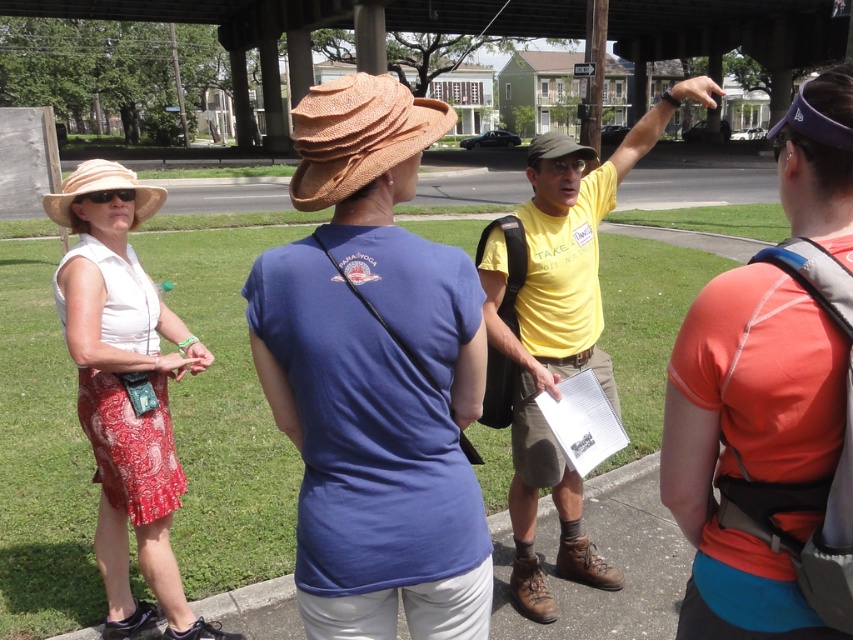
Question: Which of the following is the closest to the observer?

Choices:
 (A) (167, 508)
 (B) (415, 616)
 (C) (375, 172)

Answer: (C)

Question: Is the position of matte red dress at left more distant than that of straw textured hat at center?

Choices:
 (A) no
 (B) yes

Answer: (B)

Question: Which point appears farthest from the camera in this image?

Choices:
 (A) (675, 380)
 (B) (77, 294)
 (C) (492, 276)

Answer: (C)

Question: Is matte straw hat at center wider than yellow cotton shirt at center?

Choices:
 (A) yes
 (B) no

Answer: (B)

Question: Is orange fabric backpack at right smaller than straw textured hat at center?

Choices:
 (A) yes
 (B) no

Answer: (A)

Question: Which point is closer to the camera?

Choices:
 (A) (556, 349)
 (B) (334, 524)

Answer: (B)